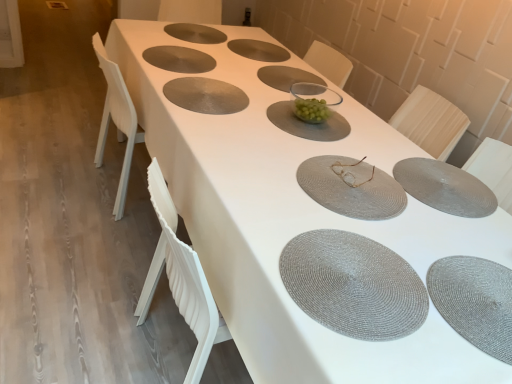
Where is `free space between gray woven placemat at lower right, the 1th tableware from the bottom, and matte gray placemat at center, which is counted as the third tableware, starting from the bottom`? The height and width of the screenshot is (384, 512). free space between gray woven placemat at lower right, the 1th tableware from the bottom, and matte gray placemat at center, which is counted as the third tableware, starting from the bottom is located at coordinates (423, 227).